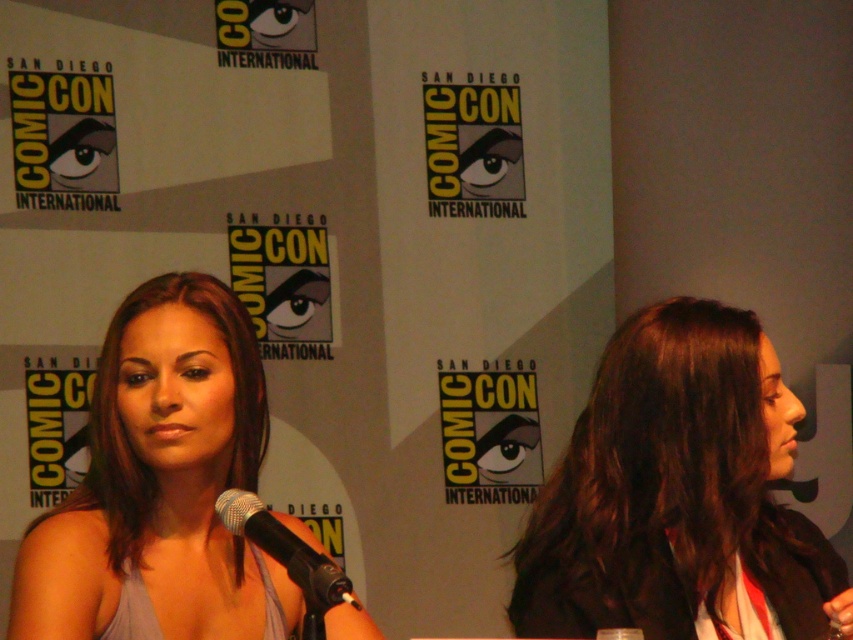
Between dark brown hair at center and matte gray dress at center, which one has less height?

Standing shorter between the two is dark brown hair at center.

Does dark brown hair at center have a lesser height compared to matte gray dress at center?

Indeed, dark brown hair at center has a lesser height compared to matte gray dress at center.

Identify the location of dark brown hair at center. The height and width of the screenshot is (640, 853). (677, 496).

Consider the image. Is dark brown hair at center smaller than black metallic microphone at center?

No.

Is dark brown hair at center shorter than black metallic microphone at center?

In fact, dark brown hair at center may be taller than black metallic microphone at center.

I want to click on dark brown hair at center, so click(x=677, y=496).

Find the location of a particular element. The width and height of the screenshot is (853, 640). dark brown hair at center is located at coordinates (677, 496).

Does matte gray dress at center appear on the left side of black metallic microphone at center?

Yes, matte gray dress at center is to the left of black metallic microphone at center.

This screenshot has height=640, width=853. Find the location of `matte gray dress at center`. matte gray dress at center is located at coordinates (161, 483).